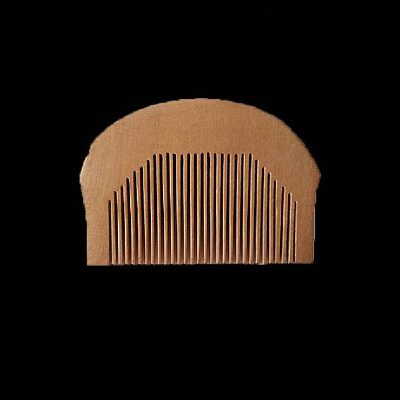
Find the location of a particular element. The height and width of the screenshot is (400, 400). comb wooden is located at coordinates (210, 119).